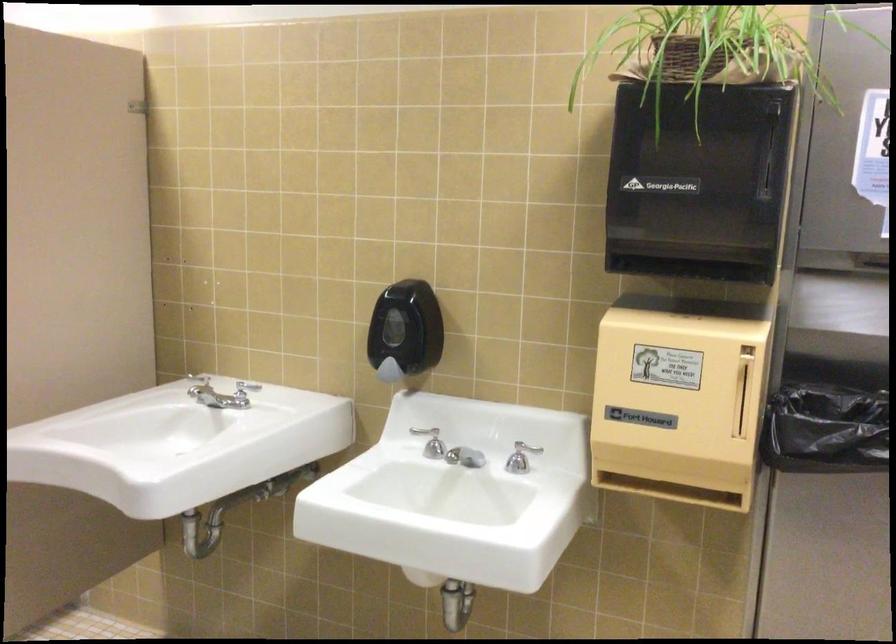
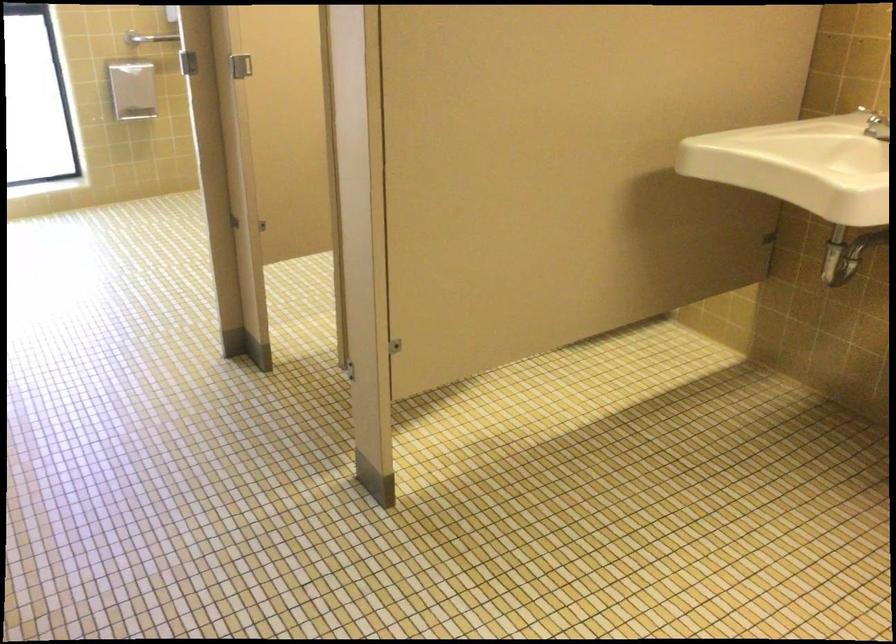
First-person continuous shooting, in which direction is the camera rotating?

The camera rotated toward left-down.